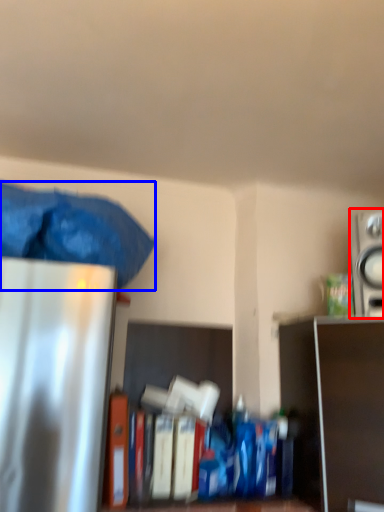
Question: Which point is closer to the camera, appliance (highlighted by a red box) or waste (highlighted by a blue box)?

Choices:
 (A) appliance
 (B) waste

Answer: (B)